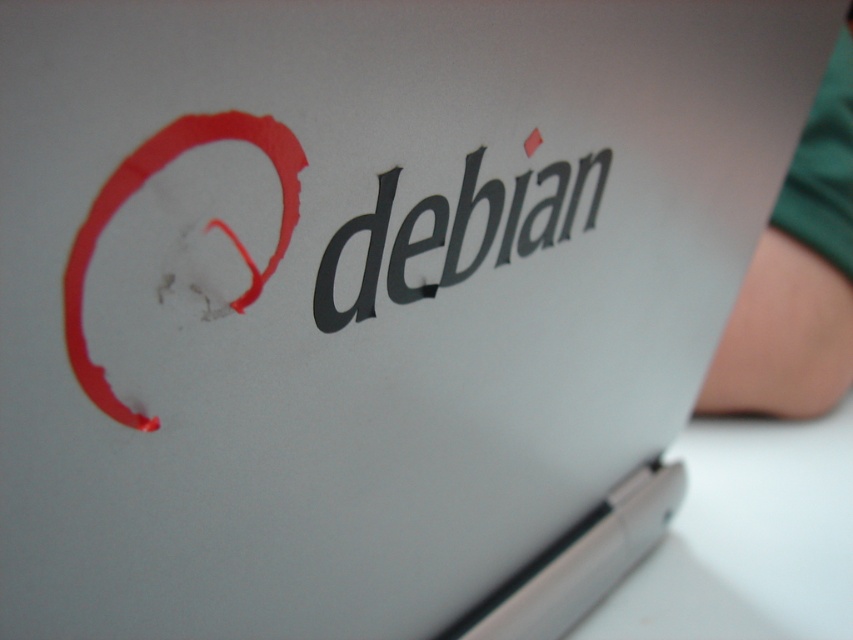
Does black matte/debossed text at center have a lesser width compared to matte red circle at upper left?

In fact, black matte/debossed text at center might be wider than matte red circle at upper left.

Can you confirm if black matte/debossed text at center is smaller than matte red circle at upper left?

Incorrect, black matte/debossed text at center is not smaller in size than matte red circle at upper left.

Is point (318, 291) farther from camera compared to point (76, 269)?

That is True.

Where is `black matte/debossed text at center`? The height and width of the screenshot is (640, 853). black matte/debossed text at center is located at coordinates (453, 234).